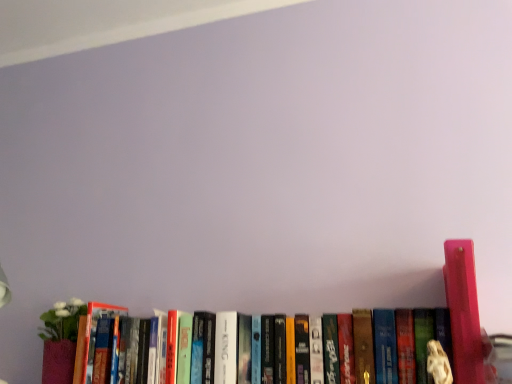
Question: Can you confirm if pink plastic figurine at right, which ranks as the first book in right-to-left order, is shorter than hardcover book at center, acting as the 2th book starting from the right?

Choices:
 (A) yes
 (B) no

Answer: (B)

Question: Is pink plastic figurine at right, which ranks as the first book in right-to-left order, turned away from hardcover book at center, acting as the 2th book starting from the right?

Choices:
 (A) no
 (B) yes

Answer: (A)

Question: Is pink plastic figurine at right, which ranks as the first book in right-to-left order, far away from hardcover book at center, placed as the 1th book when sorted from left to right?

Choices:
 (A) yes
 (B) no

Answer: (B)

Question: Is the position of pink plastic figurine at right, which ranks as the first book in right-to-left order, more distant than that of hardcover book at center, placed as the 1th book when sorted from left to right?

Choices:
 (A) yes
 (B) no

Answer: (B)

Question: From the image's perspective, is pink plastic figurine at right, which ranks as the first book in right-to-left order, on hardcover book at center, placed as the 1th book when sorted from left to right?

Choices:
 (A) yes
 (B) no

Answer: (A)

Question: Can you confirm if pink plastic figurine at right, which ranks as the first book in right-to-left order, is wider than hardcover book at center, placed as the 1th book when sorted from left to right?

Choices:
 (A) no
 (B) yes

Answer: (B)

Question: Is hardcover book at center, acting as the 2th book starting from the right, at the left side of pink plastic figurine at right, which ranks as the first book in right-to-left order?

Choices:
 (A) no
 (B) yes

Answer: (B)

Question: Are hardcover book at center, acting as the 2th book starting from the right, and pink plastic figurine at right, which ranks as the first book in right-to-left order, making contact?

Choices:
 (A) no
 (B) yes

Answer: (A)

Question: From a real-world perspective, does hardcover book at center, placed as the 1th book when sorted from left to right, sit lower than pink plastic figurine at right, which ranks as the first book in right-to-left order?

Choices:
 (A) yes
 (B) no

Answer: (A)

Question: Considering the relative positions of hardcover book at center, placed as the 1th book when sorted from left to right, and pink plastic figurine at right, which ranks as the first book in right-to-left order, in the image provided, is hardcover book at center, placed as the 1th book when sorted from left to right, to the right of pink plastic figurine at right, which ranks as the first book in right-to-left order, from the viewer's perspective?

Choices:
 (A) yes
 (B) no

Answer: (B)

Question: Considering the relative sizes of hardcover book at center, acting as the 2th book starting from the right, and pink plastic figurine at right, the 2th book from the left, in the image provided, is hardcover book at center, acting as the 2th book starting from the right, taller than pink plastic figurine at right, the 2th book from the left,?

Choices:
 (A) yes
 (B) no

Answer: (B)

Question: Is the depth of hardcover book at center, placed as the 1th book when sorted from left to right, greater than that of pink plastic figurine at right, the 2th book from the left?

Choices:
 (A) no
 (B) yes

Answer: (B)

Question: Considering the positions of hardcover book at center, acting as the 2th book starting from the right, and pink plastic figurine at right, which ranks as the first book in right-to-left order, in the image, is hardcover book at center, acting as the 2th book starting from the right, bigger or smaller than pink plastic figurine at right, which ranks as the first book in right-to-left order,?

Choices:
 (A) small
 (B) big

Answer: (B)